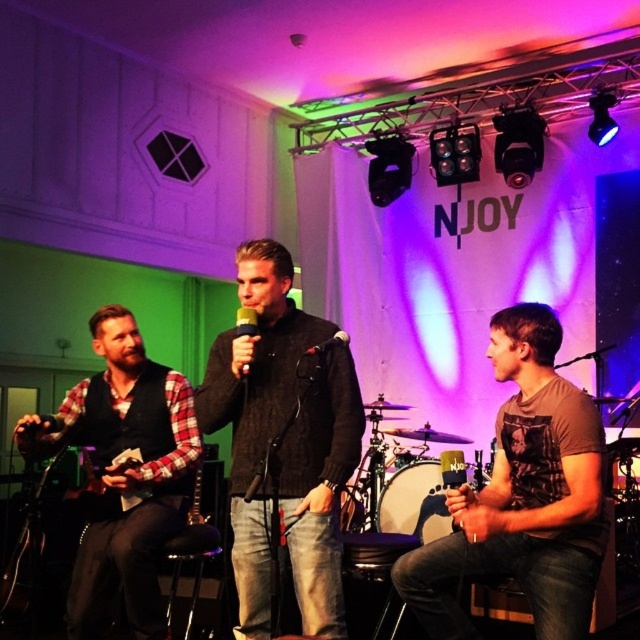
You are an event coordinator trying to set up a camera to capture the black knit sweater at center. According to the coordinates provided, where should you position the camera to best capture this object?

The black knit sweater at center is located at point 0.558 on the x and 0.402 on the y coordinates, so you should position the camera at those coordinates to best capture it.